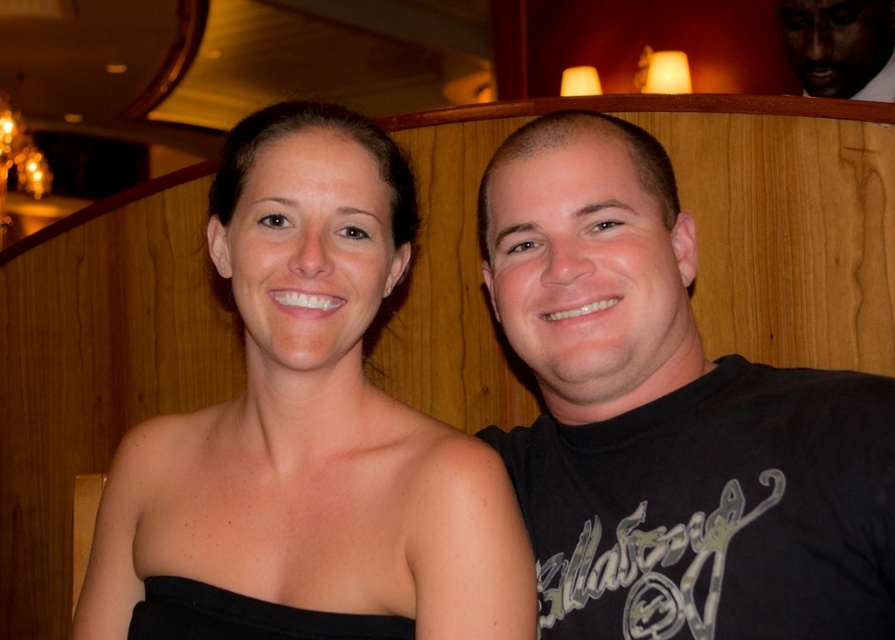
Can you confirm if black matte dress at center is positioned to the left of dark skin smooth face at upper right?

Correct, you'll find black matte dress at center to the left of dark skin smooth face at upper right.

At what (x,y) coordinates should I click in order to perform the action: click on black matte dress at center. Please return your answer as a coordinate pair (x, y). The image size is (895, 640). Looking at the image, I should click on (312, 419).

Can you confirm if black matte shirt at right is taller than black matte dress at center?

No, black matte shirt at right is not taller than black matte dress at center.

Does black matte shirt at right come behind black matte dress at center?

No.

Is point (746, 508) closer to camera compared to point (263, 204)?

That is True.

Find the location of a particular element. The image size is (895, 640). black matte shirt at right is located at coordinates (669, 419).

How far apart are black matte shirt at right and dark skin smooth face at upper right?

black matte shirt at right is 1.88 meters from dark skin smooth face at upper right.

Does black matte shirt at right have a greater width compared to dark skin smooth face at upper right?

Correct, the width of black matte shirt at right exceeds that of dark skin smooth face at upper right.

Which is in front, point (679, 316) or point (786, 38)?

Point (679, 316) is more forward.

Locate an element on the screen. Image resolution: width=895 pixels, height=640 pixels. black matte shirt at right is located at coordinates (669, 419).